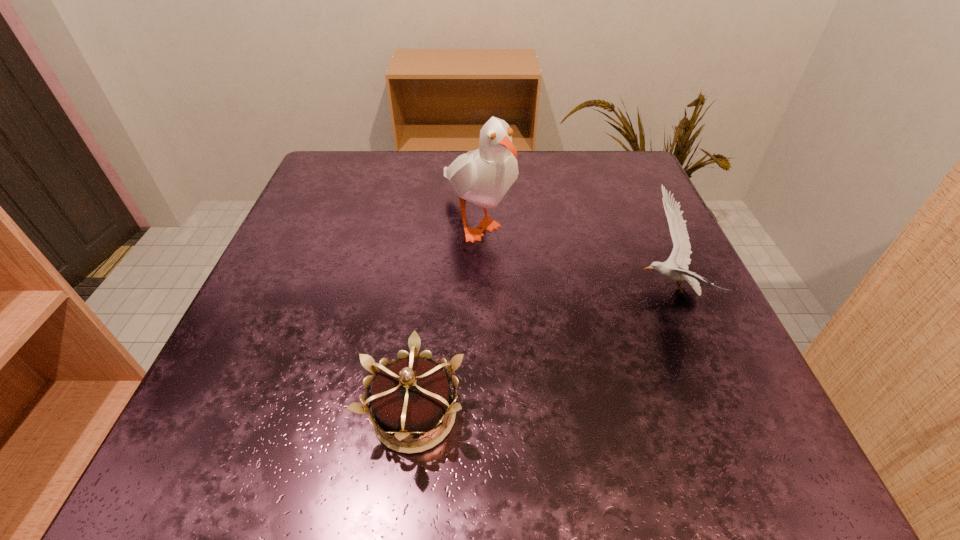
At what (x,y) coordinates should I click in order to perform the action: click on the left gull. Please return your answer as a coordinate pair (x, y). Image resolution: width=960 pixels, height=540 pixels. Looking at the image, I should click on coord(483,176).

This screenshot has height=540, width=960. I want to click on the tallest object, so (483, 176).

This screenshot has width=960, height=540. Find the location of `the right gull`. the right gull is located at coordinates (680, 256).

Image resolution: width=960 pixels, height=540 pixels. I want to click on the shorter gull, so click(x=680, y=256).

This screenshot has height=540, width=960. In order to click on the shortest object in this screenshot , I will do `click(411, 396)`.

Where is `the nearest object`? The image size is (960, 540). the nearest object is located at coordinates coord(411,396).

At what (x,y) coordinates should I click in order to perform the action: click on vacant position located 0.140m at the beak of the tallest object. Please return your answer as a coordinate pair (x, y). This screenshot has width=960, height=540. Looking at the image, I should click on tap(476, 328).

Locate an element on the screen. This screenshot has height=540, width=960. vacant region located 0.110m at the tip of the beak of the shorter gull is located at coordinates (571, 291).

Identify the location of vacant region located at the tip of the beak of the shorter gull. The height and width of the screenshot is (540, 960). (418, 291).

The width and height of the screenshot is (960, 540). I want to click on free point located 0.340m at the tip of the beak of the shorter gull, so click(x=435, y=291).